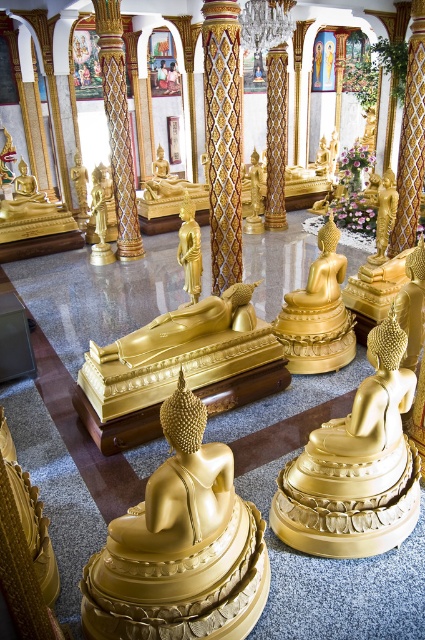
You are a visitor standing at the entrance of the temple. You notice two golden items at the center of the room. Which one is taller between the gold textured pillar at center and the gold polished statue at center?

The gold textured pillar at center is much taller than the gold polished statue at center.

You are standing in the temple and want to take a photo of the gold shiny statue at center. Where should you position yourself to ensure the statue is in the center of your camera view?

You should position yourself directly in front of the gold shiny statue at center at point coordinates (181, 547) to ensure it is centered in your camera view.

You are a visitor in the temple and want to take a photo of both the gold textured pillar at center and the gold polished statue at center. Which object should you focus on first if you want to capture both in a single frame without moving the camera?

The gold textured pillar at center is larger in size than the gold polished statue at center, so you should focus on the gold polished statue at center first to ensure it fits within the frame along with the pillar.